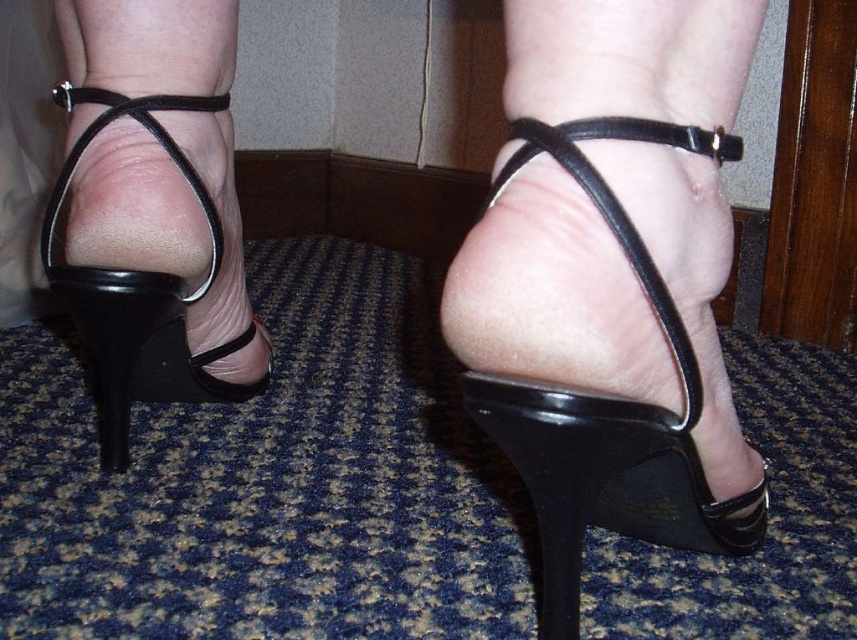
From the picture: You are standing in a hotel room and see the black shiny sandal at center. Where is the black shiny sandal located in relation to the point marked as point (610, 404)?

The black shiny sandal at center is located exactly at point (610, 404).

You are a delivery robot with a width of 12 inches. You need to move through the space between the black shiny sandal at center and the black leather sandal at left. Can you fit through this space?

The distance between the black shiny sandal at center and the black leather sandal at left is 12.84 inches. Since the robot is 12 inches wide, it can fit through the space as there is enough clearance.

You are a photographer setting up a shoot in a hotel room. You notice two pairs of black sandals in the scene. The black shiny sandal at center and the black leather sandal at left. Which sandal is closer to the camera?

The black shiny sandal at center is closer to the camera because it is in front of the black leather sandal at left.